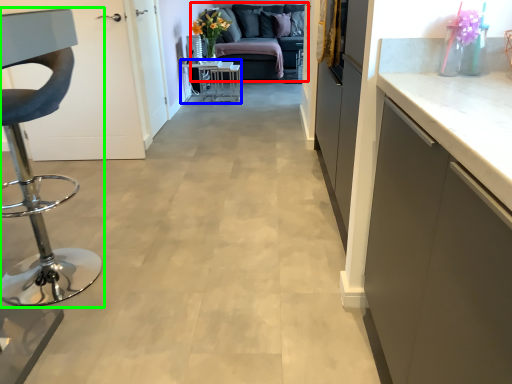
Question: Which object is positioned closest to studio couch (highlighted by a red box)? Select from table (highlighted by a blue box) and furniture (highlighted by a green box).

Choices:
 (A) table
 (B) furniture

Answer: (A)